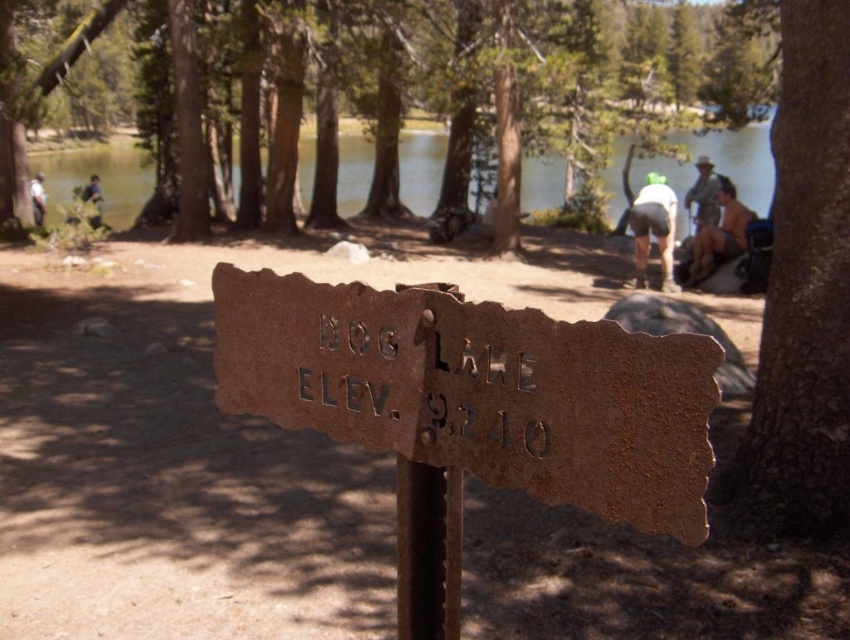
Who is shorter, brown textured tree at center or tan skin person at right?

Standing shorter between the two is tan skin person at right.

Is point (565, 83) farther from camera compared to point (709, 228)?

Yes, point (565, 83) is behind point (709, 228).

I want to click on brown textured tree at center, so click(564, 97).

Who is taller, brown rough bark tree at right or green fabric backpack at upper left?

With more height is green fabric backpack at upper left.

How distant is brown rough bark tree at right from green fabric backpack at upper left?

17.37 meters

Does point (812, 35) lie in front of point (99, 205)?

Yes, point (812, 35) is in front of point (99, 205).

This screenshot has height=640, width=850. Find the location of `brown rough bark tree at right`. brown rough bark tree at right is located at coordinates [x=802, y=296].

Is brown textured tree at center closer to camera compared to camouflage jacket at upper right?

Yes, it is in front of camouflage jacket at upper right.

Between point (88, 26) and point (710, 166), which one is positioned behind?

The point (88, 26) is more distant.

Locate an element on the screen. brown textured tree at center is located at coordinates (564, 97).